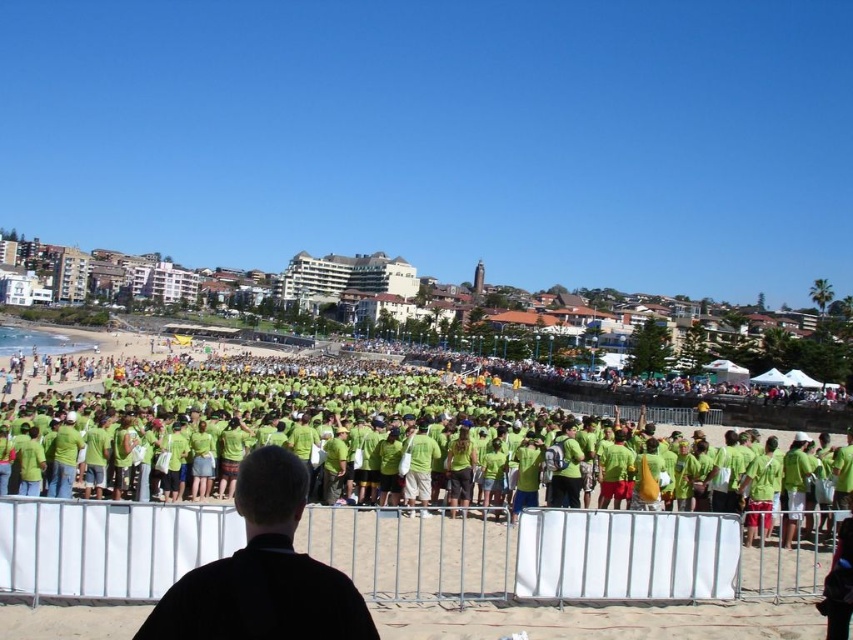
Is green fabric crowd at center to the left of black matte jacket at center from the viewer's perspective?

Incorrect, green fabric crowd at center is not on the left side of black matte jacket at center.

Does green fabric crowd at center have a lesser height compared to black matte jacket at center?

Indeed, green fabric crowd at center has a lesser height compared to black matte jacket at center.

At what (x,y) coordinates should I click in order to perform the action: click on green fabric crowd at center. Please return your answer as a coordinate pair (x, y). The image size is (853, 640). Looking at the image, I should click on pos(376,440).